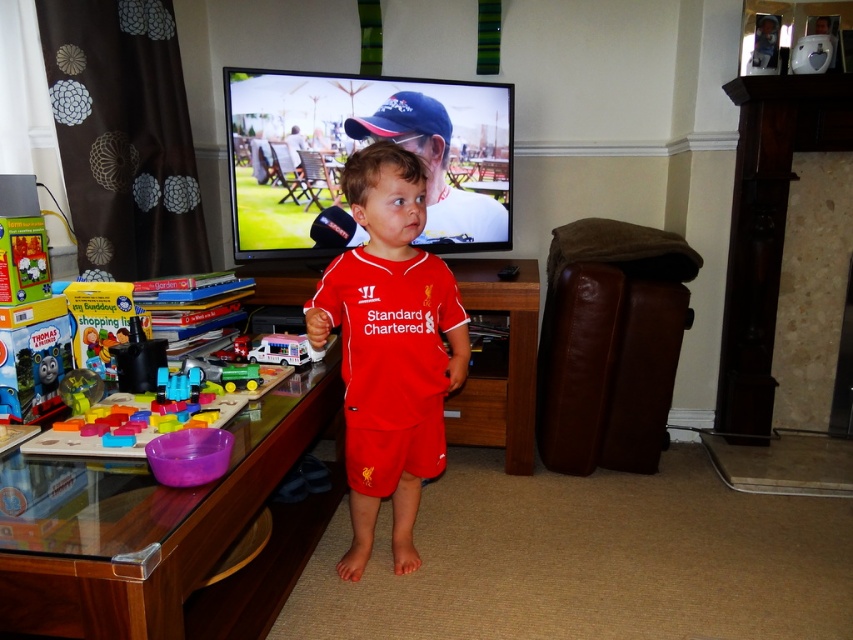
You are standing in the living room and want to place a new decoration on the blue fabric baseball cap at upper center. According to the scene description, where exactly is the blue fabric baseball cap located?

The blue fabric baseball cap at upper center is located at point (402, 118).

Consider the image. Where is the matte red jersey at center located in the image?

The matte red jersey at center is located at point (389,348) in the image.